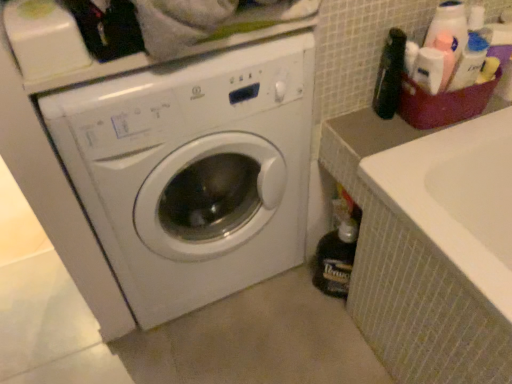
Identify the location of vacant space in front of dark brown glass bottle at lower right, which is the 1th bottle from back to front. This screenshot has height=384, width=512. (336, 337).